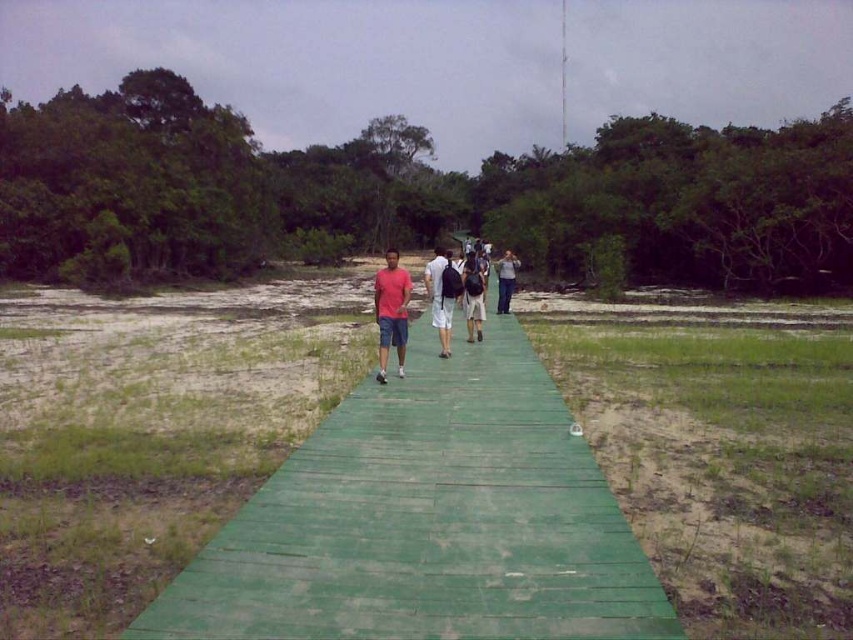
Consider the image. You are standing at the starting point of the green wooden path at center. If you walk straight ahead, which direction will you be facing relative to the boardwalk?

Since the green wooden path at center is positioned at coordinates point (428, 522), walking straight ahead along the boardwalk would mean continuing in the direction it extends into the distance.